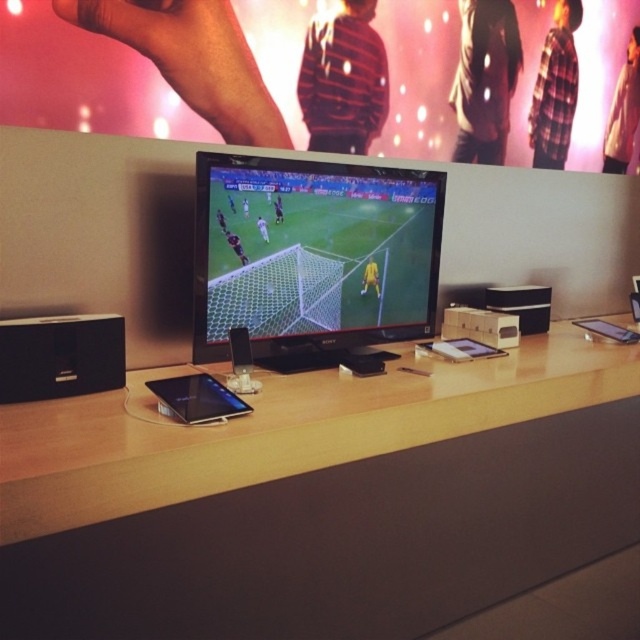
Is point (240, 180) more distant than point (77, 324)?

Yes, point (240, 180) is farther from viewer.

Is satin black monitor at center shorter than black plastic speaker at lower left?

No.

What are the coordinates of `satin black monitor at center` in the screenshot? It's located at (312, 257).

This screenshot has height=640, width=640. I want to click on satin black monitor at center, so click(x=312, y=257).

In the scene shown: Does wooden table at center appear over satin black monitor at center?

Actually, wooden table at center is below satin black monitor at center.

Between wooden table at center and satin black monitor at center, which one appears on the right side from the viewer's perspective?

wooden table at center is more to the right.

Who is more distant from viewer, (115, 454) or (216, 212)?

The point (216, 212) is behind.

At what (x,y) coordinates should I click in order to perform the action: click on wooden table at center. Please return your answer as a coordinate pair (x, y). The image size is (640, 640). Looking at the image, I should click on (321, 499).

Is wooden table at center taller than black plastic speaker at lower left?

Correct, wooden table at center is much taller as black plastic speaker at lower left.

Can you confirm if wooden table at center is smaller than black plastic speaker at lower left?

No.

Is point (566, 557) closer to viewer compared to point (64, 394)?

No.

The width and height of the screenshot is (640, 640). What are the coordinates of `wooden table at center` in the screenshot? It's located at (321, 499).